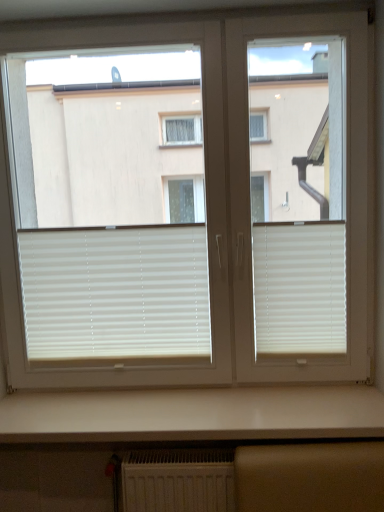
The width and height of the screenshot is (384, 512). I want to click on white glossy counter top at lower center, so click(192, 414).

Describe the element at coordinates (298, 198) in the screenshot. The height and width of the screenshot is (512, 384). I see `white matte blinds at center` at that location.

At what (x,y) coordinates should I click in order to perform the action: click on white textured radiator at lower center. Please return your answer as a coordinate pair (x, y). Looking at the image, I should click on (178, 480).

Locate an element on the screen. The image size is (384, 512). white matte blinds at center, marked as the 2th window blind in a right-to-left arrangement is located at coordinates (115, 292).

Find the location of a particular element. The height and width of the screenshot is (512, 384). white matte blinds at center is located at coordinates (201, 220).

Identify the location of white glossy counter top at lower center. This screenshot has width=384, height=512. point(192,414).

What's the angular difference between white matte blinds at center and white glossy counter top at lower center's facing directions?

0.227 degrees separate the facing orientations of white matte blinds at center and white glossy counter top at lower center.

From a real-world perspective, who is located lower, white matte blinds at center or white glossy counter top at lower center?

white glossy counter top at lower center, from a real-world perspective.

Measure the distance from white matte blinds at center to white glossy counter top at lower center.

white matte blinds at center and white glossy counter top at lower center are 2.54 meters apart from each other.

Is white matte blinds at center turned away from white glossy counter top at lower center?

No, white matte blinds at center is not facing the opposite direction of white glossy counter top at lower center.

Would you say white matte blinds at center, placed as the first window blind when sorted from left to right, is part of white textured radiator at lower center's contents?

No, white matte blinds at center, placed as the first window blind when sorted from left to right, is not a part of white textured radiator at lower center.

From a real-world perspective, which window blind is the 1st one above the white textured radiator at lower center? Please provide its 2D coordinates.

[(115, 292)]

Which object is closer to the camera taking this photo, white textured radiator at lower center or white matte blinds at center, placed as the first window blind when sorted from left to right?

Positioned in front is white textured radiator at lower center.

Is white textured radiator at lower center oriented away from white matte blinds at center, placed as the first window blind when sorted from left to right?

No, white textured radiator at lower center's orientation is not away from white matte blinds at center, placed as the first window blind when sorted from left to right.

From a real-world perspective, who is located lower, white matte blinds at center, marked as the 2th window blind in a right-to-left arrangement, or white matte blinds at center?

white matte blinds at center, marked as the 2th window blind in a right-to-left arrangement.

Does point (47, 265) come farther from viewer compared to point (44, 91)?

No, it is not.

Is the depth of white matte blinds at center, placed as the first window blind when sorted from left to right, less than that of white matte blinds at center?

No, white matte blinds at center, placed as the first window blind when sorted from left to right, is behind white matte blinds at center.

Is white matte blinds at center at the back of white matte blinds at center, marked as the 2th window blind in a right-to-left arrangement?

Yes, white matte blinds at center, marked as the 2th window blind in a right-to-left arrangement,'s orientation is away from white matte blinds at center.

Is white matte blinds at right, arranged as the 2th window blind when viewed from the left, situated inside white matte blinds at center or outside?

white matte blinds at right, arranged as the 2th window blind when viewed from the left, is located beyond the bounds of white matte blinds at center.

Is white matte blinds at right, positioned as the first window blind in right-to-left order, further to camera compared to white matte blinds at center?

Yes.

From the image's perspective, which one is positioned higher, white matte blinds at right, positioned as the first window blind in right-to-left order, or white matte blinds at center?

From the image's view, white matte blinds at center is above.

Can you tell me how much white matte blinds at right, positioned as the first window blind in right-to-left order, and white matte blinds at center differ in facing direction?

0.0159 degrees.

This screenshot has height=512, width=384. I want to click on the 2nd window blind positioned below the white matte blinds at center (from a real-world perspective), so click(115, 292).

Which is more to the left, white matte blinds at center or white matte blinds at center, placed as the first window blind when sorted from left to right?

Positioned to the left is white matte blinds at center, placed as the first window blind when sorted from left to right.

Which object is wider, white matte blinds at center or white matte blinds at center, marked as the 2th window blind in a right-to-left arrangement?

With larger width is white matte blinds at center.

From the image's perspective, which is below, white matte blinds at center or white matte blinds at center, placed as the first window blind when sorted from left to right?

white matte blinds at center, placed as the first window blind when sorted from left to right, from the image's perspective.

Which is farther from the camera, (181, 293) or (124, 465)?

A: The point (181, 293) is farther from the camera.

From a real-world perspective, is white matte blinds at center, marked as the 2th window blind in a right-to-left arrangement, physically above white textured radiator at lower center?

Correct, in the physical world, white matte blinds at center, marked as the 2th window blind in a right-to-left arrangement, is higher than white textured radiator at lower center.

Identify the location of the 1st window blind above when counting from the white textured radiator at lower center (from the image's perspective). (115, 292).

In terms of height, does white matte blinds at center, placed as the first window blind when sorted from left to right, look taller or shorter compared to white textured radiator at lower center?

Clearly, white matte blinds at center, placed as the first window blind when sorted from left to right, is taller compared to white textured radiator at lower center.

From the image's perspective, which object appears higher, white matte blinds at center or white textured radiator at lower center?

white matte blinds at center.

Looking at their sizes, would you say white matte blinds at center is wider or thinner than white textured radiator at lower center?

Clearly, white matte blinds at center has more width compared to white textured radiator at lower center.

Which is more to the right, white matte blinds at center or white textured radiator at lower center?

From the viewer's perspective, white matte blinds at center appears more on the right side.

This screenshot has width=384, height=512. Find the location of `counter top that is on the left side of white matte blinds at center`. counter top that is on the left side of white matte blinds at center is located at coordinates pyautogui.click(x=192, y=414).

The width and height of the screenshot is (384, 512). I want to click on the 2nd window blind behind when counting from the white textured radiator at lower center, so click(115, 292).

Which object lies nearer to the anchor point white glossy counter top at lower center, white matte blinds at center, marked as the 2th window blind in a right-to-left arrangement, or white matte blinds at right, positioned as the first window blind in right-to-left order?

Among the two, white matte blinds at center, marked as the 2th window blind in a right-to-left arrangement, is located nearer to white glossy counter top at lower center.

Considering their positions, is white matte blinds at center, marked as the 2th window blind in a right-to-left arrangement, positioned closer to white matte blinds at center than white textured radiator at lower center?

white matte blinds at center, marked as the 2th window blind in a right-to-left arrangement, is positioned closer to the anchor white matte blinds at center.

Based on their spatial positions, is white matte blinds at right, arranged as the 2th window blind when viewed from the left, or white matte blinds at center closer to white matte blinds at center?

Among the two, white matte blinds at center is located nearer to white matte blinds at center.

From the image, which object appears to be nearer to white textured radiator at lower center, white matte blinds at center, placed as the first window blind when sorted from left to right, or white matte blinds at right, positioned as the first window blind in right-to-left order?

white matte blinds at center, placed as the first window blind when sorted from left to right, is closer to white textured radiator at lower center.

Based on their spatial positions, is white matte blinds at center, placed as the first window blind when sorted from left to right, or white matte blinds at right, arranged as the 2th window blind when viewed from the left, further from white matte blinds at center?

The object further to white matte blinds at center is white matte blinds at center, placed as the first window blind when sorted from left to right.

Considering their positions, is white glossy counter top at lower center positioned further to white matte blinds at center than white matte blinds at center, marked as the 2th window blind in a right-to-left arrangement?

Based on the image, white glossy counter top at lower center appears to be further to white matte blinds at center.

Considering their positions, is white matte blinds at center, marked as the 2th window blind in a right-to-left arrangement, positioned further to white matte blinds at right, arranged as the 2th window blind when viewed from the left, than white matte blinds at center?

white matte blinds at center lies further to white matte blinds at right, arranged as the 2th window blind when viewed from the left, than the other object.

When comparing their distances from white matte blinds at right, positioned as the first window blind in right-to-left order, does white matte blinds at center, placed as the first window blind when sorted from left to right, or white textured radiator at lower center seem closer?

white matte blinds at center, placed as the first window blind when sorted from left to right.

In order to click on counter top between white matte blinds at right, positioned as the first window blind in right-to-left order, and white textured radiator at lower center in the up-down direction in this screenshot , I will do `click(192, 414)`.

Where is `window between white matte blinds at center and white textured radiator at lower center in the vertical direction`? window between white matte blinds at center and white textured radiator at lower center in the vertical direction is located at coordinates (201, 220).

Where is `counter top between white matte blinds at center and white textured radiator at lower center in the up-down direction`? This screenshot has height=512, width=384. counter top between white matte blinds at center and white textured radiator at lower center in the up-down direction is located at coordinates (192, 414).

Identify the location of screen door located between white matte blinds at center and white matte blinds at right, positioned as the first window blind in right-to-left order, in the left-right direction. This screenshot has height=512, width=384. (298, 198).